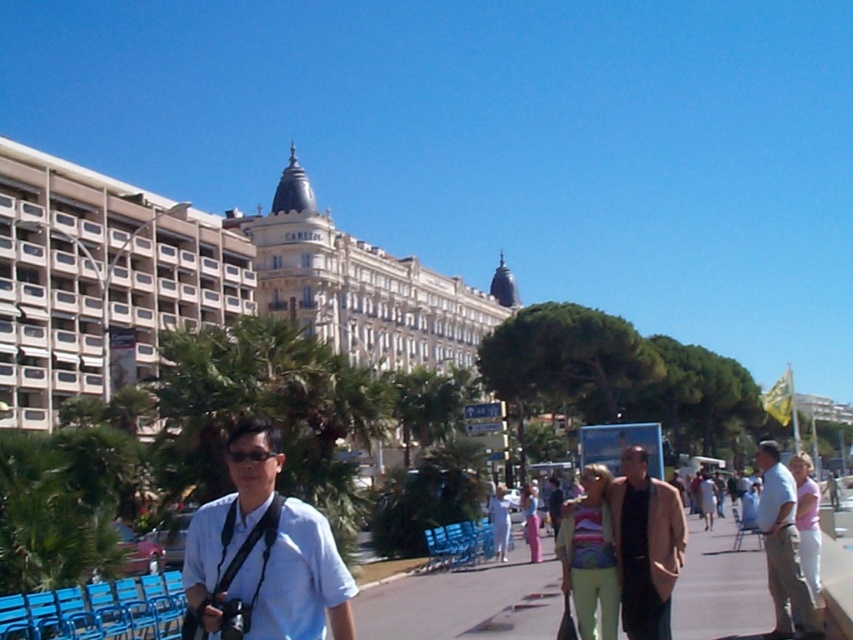
You are a photographer trying to capture a tourist wearing a light blue shirt at center in the scene. Where exactly should you focus your camera to ensure the tourist is in the frame?

You should focus your camera at point (782, 548) to capture the tourist wearing the light blue shirt at center.

You are a photographer trying to capture the tourist in the scene. Which object, the white matte shirt at center or the black plastic sunglasses at center, should you focus on first to ensure it appears clearer in your photo?

The white matte shirt at center is closer to the viewer than the black plastic sunglasses at center, so focusing on the white matte shirt at center first will ensure it appears clearer in the photo.